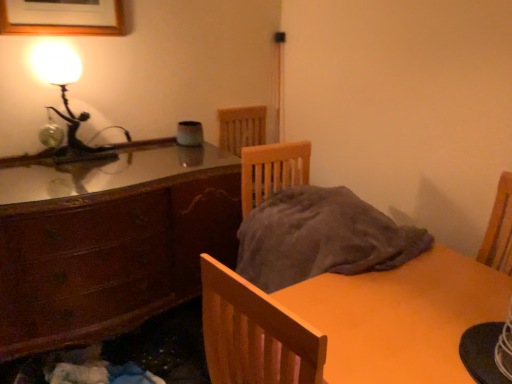
Find the location of a particular element. vacant area on top of matte wooden table at lower right (from a real-world perspective) is located at coordinates (x=437, y=329).